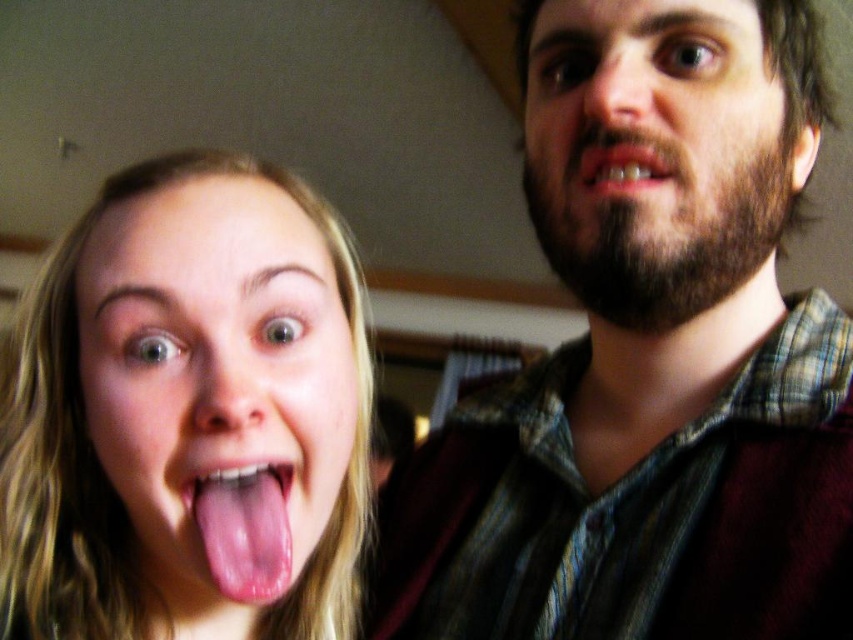
From the picture: What are the coordinates of the pink flesh at center in the image?

The pink flesh at center is located at coordinates point (216, 385).

Based on the photo, you are an artist who needs to paint a portrait of the scene. The pink flesh at center is crucial for the composition. Where exactly should you place it on your canvas using coordinates?

The pink flesh at center should be placed at coordinates point (216, 385) on the canvas.